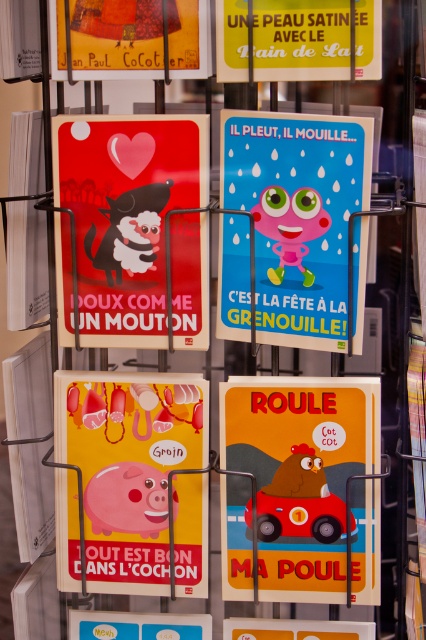
In the scene shown: You are standing in front of a wall where the blue glossy poster at center and the matte yellow poster at upper left are displayed. Which poster is positioned higher up on the wall?

The matte yellow poster at upper left is positioned higher up on the wall than the blue glossy poster at center.

You are organizing a display of greeting cards and need to place the matte red poster at upper left and the matte yellow poster at upper left. Which one should you place on the left side to maintain the current arrangement?

The matte red poster at upper left should be placed on the left side because it is already positioned on the left side of the matte yellow poster at upper left in the current arrangement.

You are a delivery person who needs to place a package between the matte plastic car at center and the yellow satin skin at upper center. The package is 20 inches long. Will it fit in the space between them?

The distance between the matte plastic car at center and the yellow satin skin at upper center is 24.00 inches. Since the package is 20 inches long, it will fit with 4 inches of space remaining.